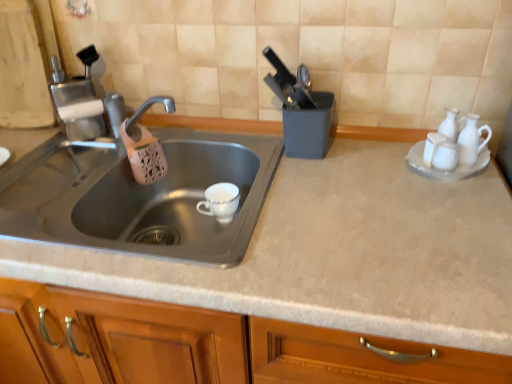
You are a GUI agent. You are given a task and a screenshot of the screen. Output one action in this format:
    pyautogui.click(x=<x>, y=<y>)
    Task: Click on the vacant space situated on the left part of white glossy salt shaker at upper right, arranged as the 2th tableware when viewed from the back
    Image resolution: width=512 pixels, height=384 pixels.
    Given the screenshot: What is the action you would take?
    pyautogui.click(x=369, y=169)